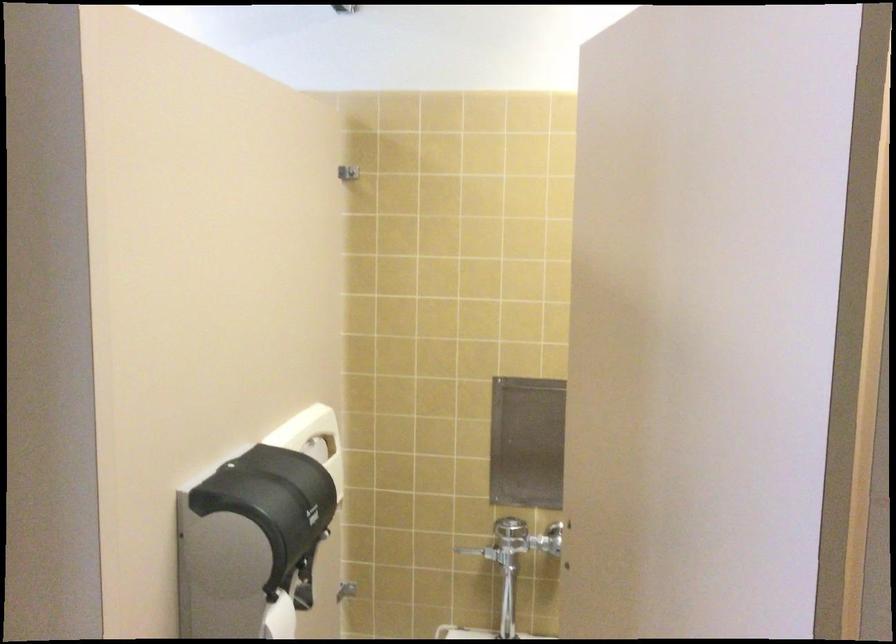
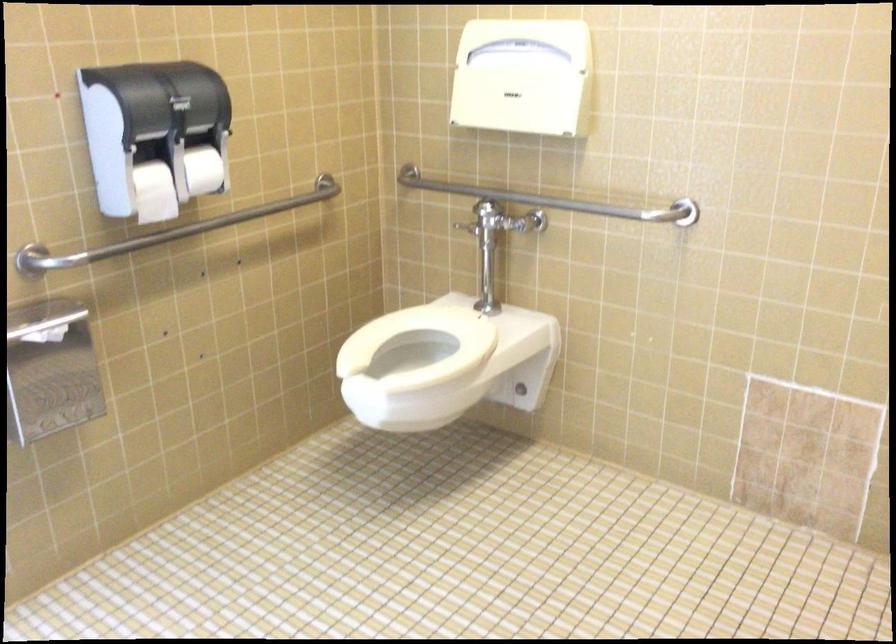
Question: How did the camera likely rotate?

Choices:
 (A) Left
 (B) Right
 (C) Up
 (D) Down

Answer: (A)